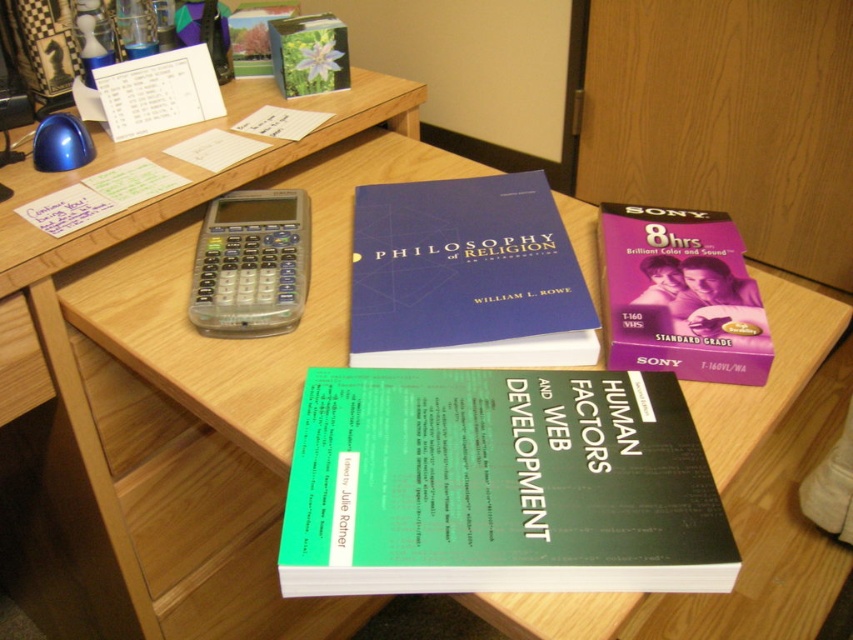
Does green matte book at center have a greater height compared to wooden drawer at lower left?

Correct, green matte book at center is much taller as wooden drawer at lower left.

Between point (682, 456) and point (30, 336), which one is positioned behind?

Point (30, 336)

You are a GUI agent. You are given a task and a screenshot of the screen. Output one action in this format:
    pyautogui.click(x=<x>, y=<y>)
    Task: Click on the green matte book at center
    
    Given the screenshot: What is the action you would take?
    pyautogui.click(x=498, y=484)

Does green matte book at center have a greater height compared to purple plastic tape at upper right?

In fact, green matte book at center may be shorter than purple plastic tape at upper right.

Is point (698, 496) closer to viewer compared to point (659, 310)?

Yes, point (698, 496) is closer to viewer.

Describe the element at coordinates (498, 484) in the screenshot. I see `green matte book at center` at that location.

Locate an element on the screen. green matte book at center is located at coordinates [498, 484].

Between green matte book at center and matte blue book at center, which one appears on the right side from the viewer's perspective?

Positioned to the right is green matte book at center.

Between green matte book at center and matte blue book at center, which one appears on the left side from the viewer's perspective?

matte blue book at center

This screenshot has height=640, width=853. Find the location of `green matte book at center`. green matte book at center is located at coordinates (498, 484).

Find the location of a particular element. This screenshot has width=853, height=640. green matte book at center is located at coordinates (498, 484).